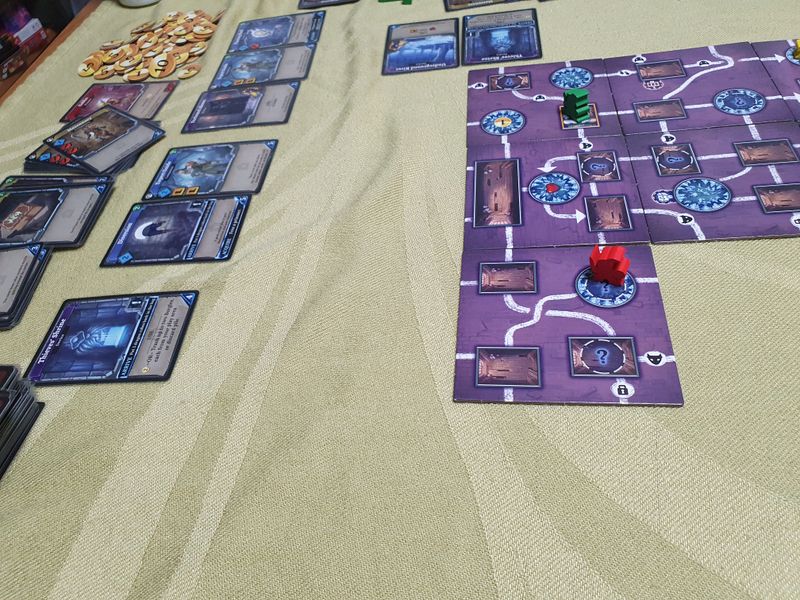
Find the location of a particular element. The height and width of the screenshot is (600, 800). purple game board is located at coordinates (560, 292), (541, 185), (526, 135), (681, 220), (662, 94), (786, 71).